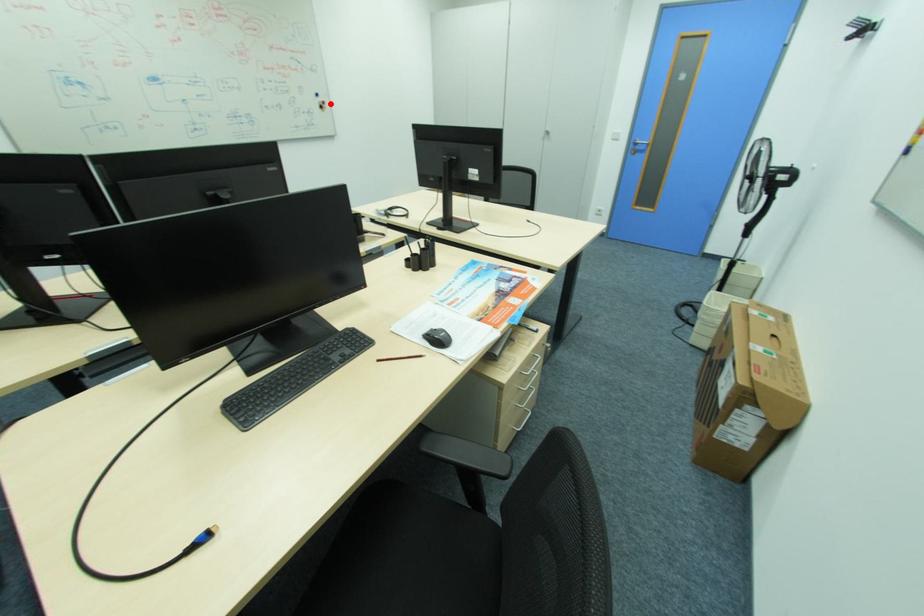
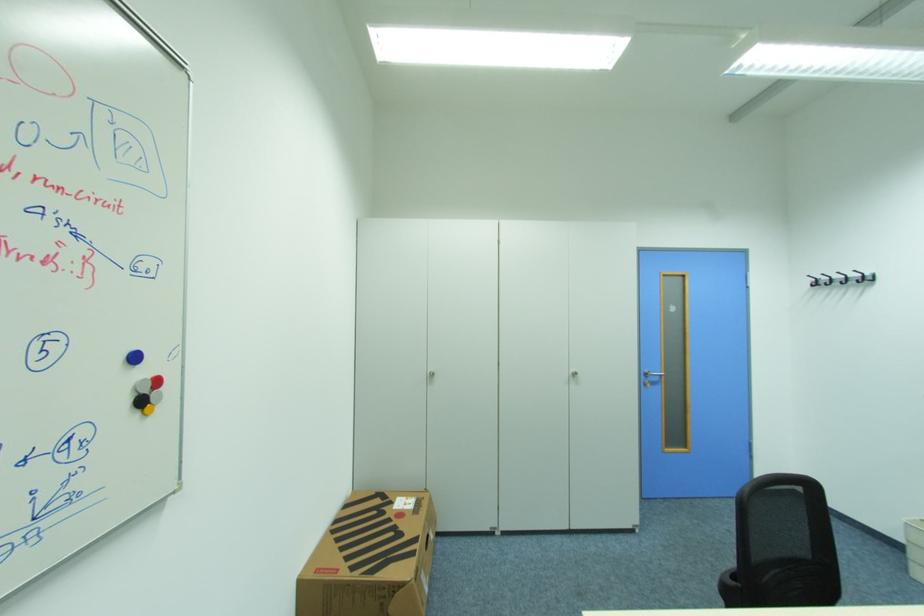
Find the pixel in the second image that matches the highlighted location in the first image.

(162, 382)